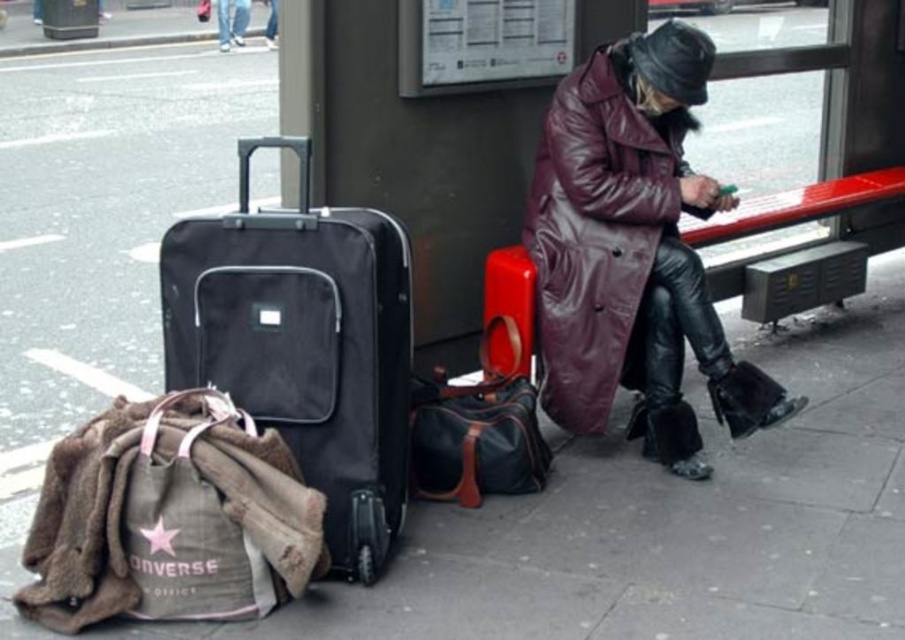
Based on the photo, you are packing for a trip and need to choose between the maroon leather coat at center and the denim jacket at lower right. Which one can you fit into your small backpack if the backpack can only hold items smaller than the other?

The maroon leather coat at center is smaller than the denim jacket at lower right, so it can fit into the small backpack.

You are a traveler who needs to choose between packing your maroon leather coat at center and your denim jacket at lower right for a trip. Based on their sizes, which one would you recommend taking if you have limited space in your luggage?

The maroon leather coat at center is much taller than the denim jacket at lower right, so it would take up more space. Therefore, the denim jacket at lower right is the better choice for limited space.